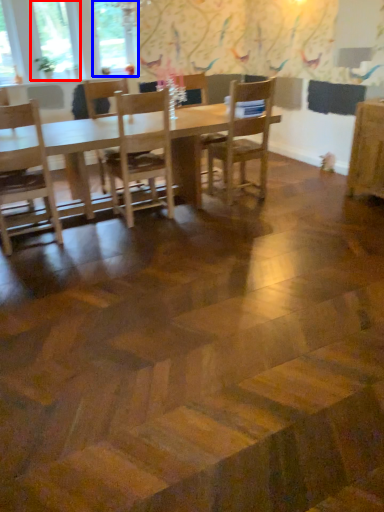
Question: Which object appears closest to the camera in this image, window (highlighted by a red box) or window (highlighted by a blue box)?

Choices:
 (A) window
 (B) window

Answer: (A)